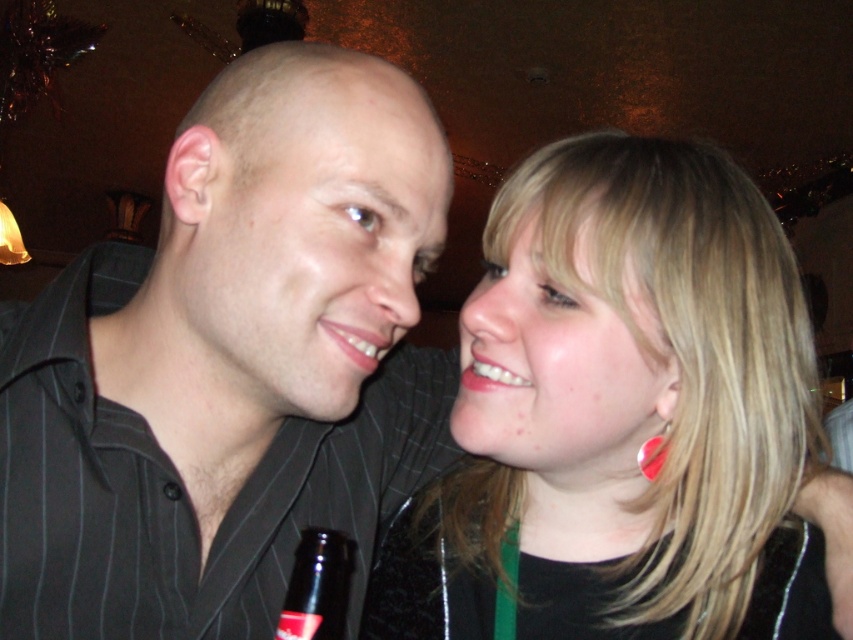
Who is more distant from viewer, (x=241, y=520) or (x=729, y=256)?

Positioned behind is point (x=241, y=520).

Who is more forward, (190, 621) or (811, 554)?

Positioned in front is point (190, 621).

Locate an element on the screen. The image size is (853, 640). black pinstripe shirt at left is located at coordinates (229, 364).

Is black glass bottle at lower center to the right of matte pink lipstick at center from the viewer's perspective?

In fact, black glass bottle at lower center is to the left of matte pink lipstick at center.

Which is in front, point (332, 609) or point (370, 337)?

Positioned in front is point (370, 337).

Describe the element at coordinates (317, 586) in the screenshot. I see `black glass bottle at lower center` at that location.

Where is `black glass bottle at lower center`? This screenshot has width=853, height=640. black glass bottle at lower center is located at coordinates (317, 586).

Between point (492, 365) and point (643, 460), which one is positioned in front?

Point (492, 365) is in front.

Is matte pink lipstick at lower right to the left of red glass earring at upper right from the viewer's perspective?

Yes, matte pink lipstick at lower right is to the left of red glass earring at upper right.

Find the location of a particular element. This screenshot has height=640, width=853. matte pink lipstick at lower right is located at coordinates (489, 376).